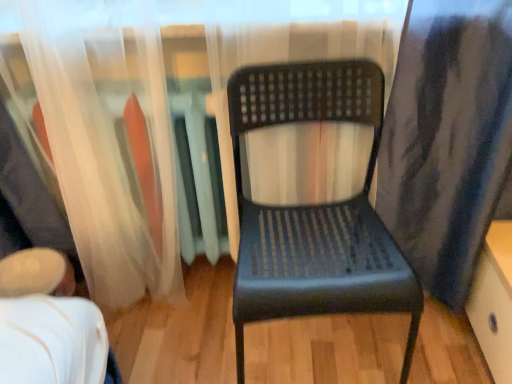
This screenshot has width=512, height=384. What do you see at coordinates (315, 208) in the screenshot?
I see `matte black chair at center` at bounding box center [315, 208].

What is the approximate height of matte black chair at center?

matte black chair at center is 30.59 inches tall.

This screenshot has width=512, height=384. What are the coordinates of `matte black chair at center` in the screenshot? It's located at click(315, 208).

At what (x,y) coordinates should I click in order to perform the action: click on matte black chair at center. Please return your answer as a coordinate pair (x, y). The image size is (512, 384). Looking at the image, I should click on (315, 208).